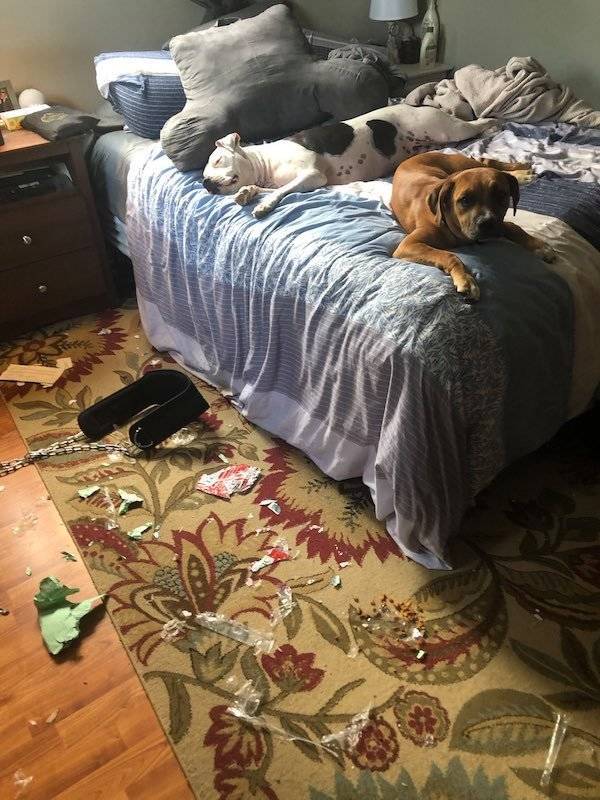
Identify the location of floor. (91, 729).